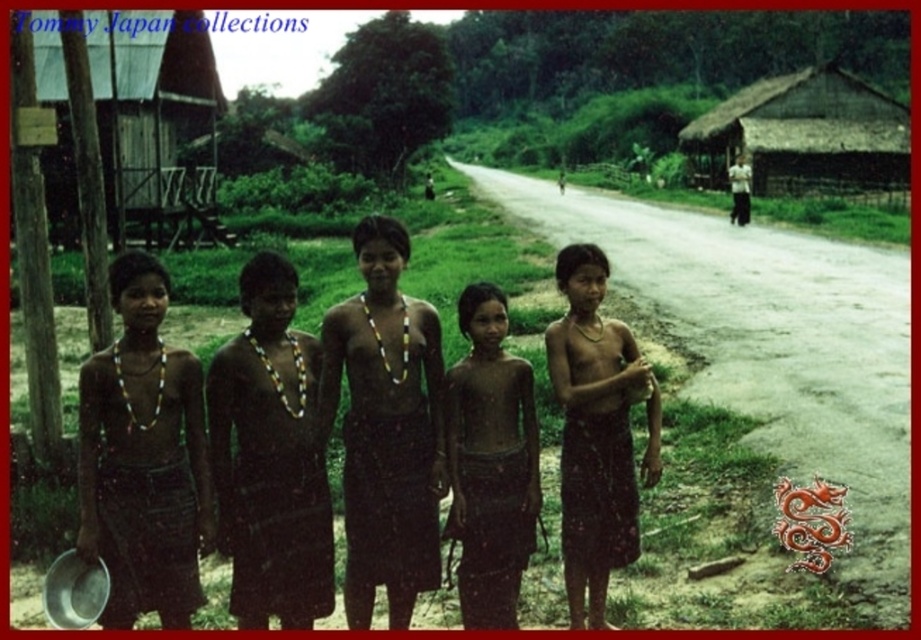
You are a tailor observing two skirts in the image, the brown fabric skirt at center and the brown woven skirt at center. Which one is narrower?

The brown fabric skirt at center is narrower than the brown woven skirt at center.

You are a traveler who wants to know which object is closer to you between the brown fabric skirt at center and the wooden hut at left. Based on the scene description, which one is closer?

The brown fabric skirt at center is closer to you because it is shorter than the wooden hut at left, indicating it is positioned in front of the hut.

You are standing at the point labeled point (415, 506) and want to walk towards the point labeled point (566, 588). Which direction should you face to move towards it?

Since point (415, 506) is closer to the camera than point (566, 588), you should face away from the camera to move towards point (566, 588).